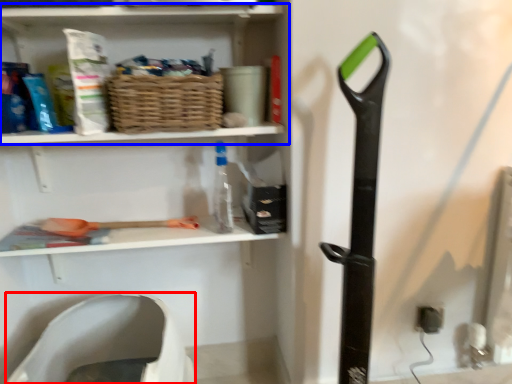
Question: Among these objects, which one is nearest to the camera, wide (highlighted by a red box) or shelf (highlighted by a blue box)?

Choices:
 (A) wide
 (B) shelf

Answer: (A)